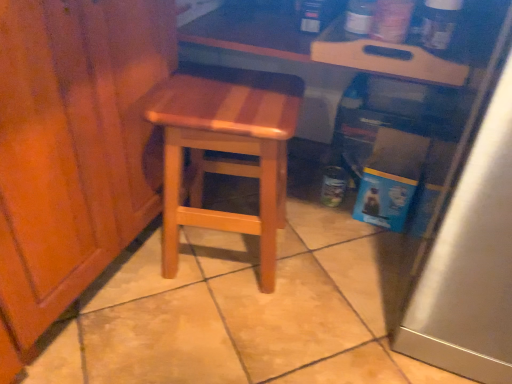
Find the location of a particular element. empty space that is ontop of natural wood stool at center (from a real-world perspective) is located at coordinates 229,96.